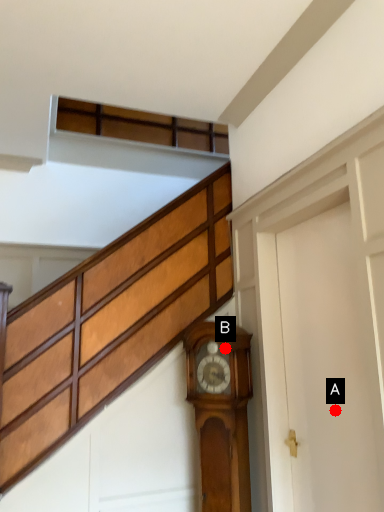
Question: Two points are circled on the image, labeled by A and B beside each circle. Which point is closer to the camera?

Choices:
 (A) A is closer
 (B) B is closer

Answer: (A)